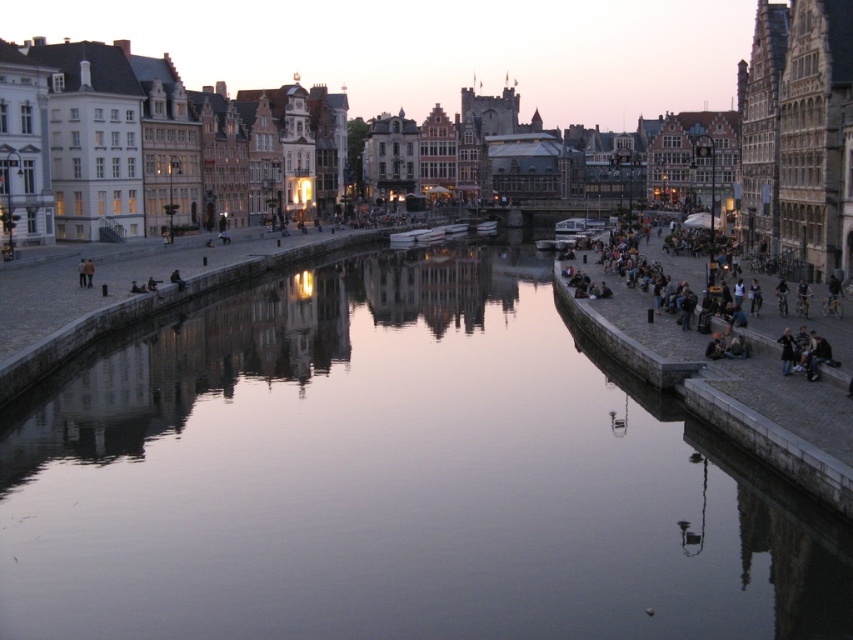
Question: Can you confirm if dark gray stone people at right is positioned above dark blue jeans at lower right?

Choices:
 (A) yes
 (B) no

Answer: (A)

Question: Does smooth water at center have a greater width compared to dark blue jeans at lower right?

Choices:
 (A) no
 (B) yes

Answer: (B)

Question: Which point appears closest to the camera in this image?

Choices:
 (A) (770, 378)
 (B) (784, 362)
 (C) (84, 561)

Answer: (C)

Question: Does smooth water at center have a greater width compared to dark blue jeans at lower right?

Choices:
 (A) yes
 (B) no

Answer: (A)

Question: Which of the following is the farthest from the observer?

Choices:
 (A) (645, 300)
 (B) (288, 296)

Answer: (B)

Question: Which point is closer to the camera?

Choices:
 (A) dark gray stone people at right
 (B) smooth water at center
 (C) dark blue jeans at lower right

Answer: (B)